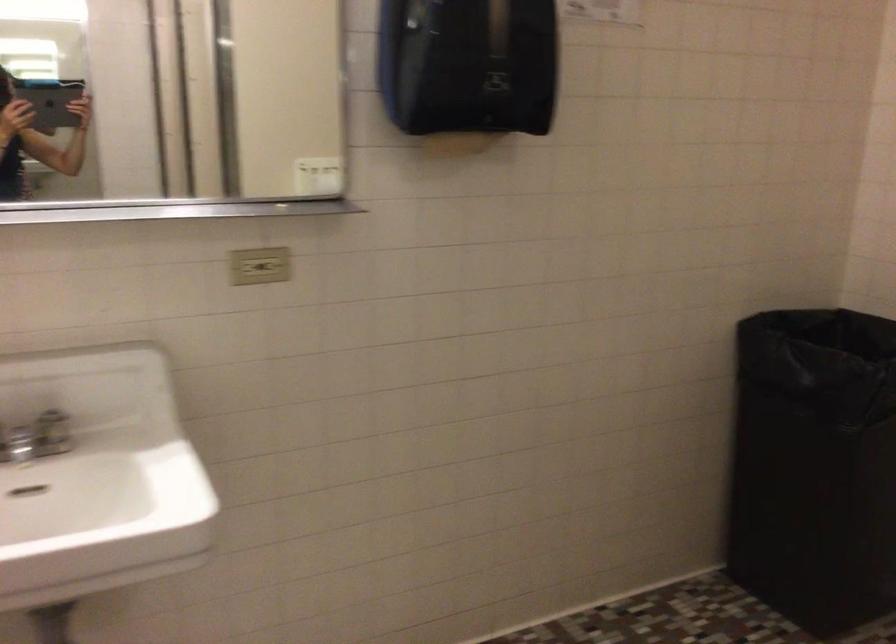
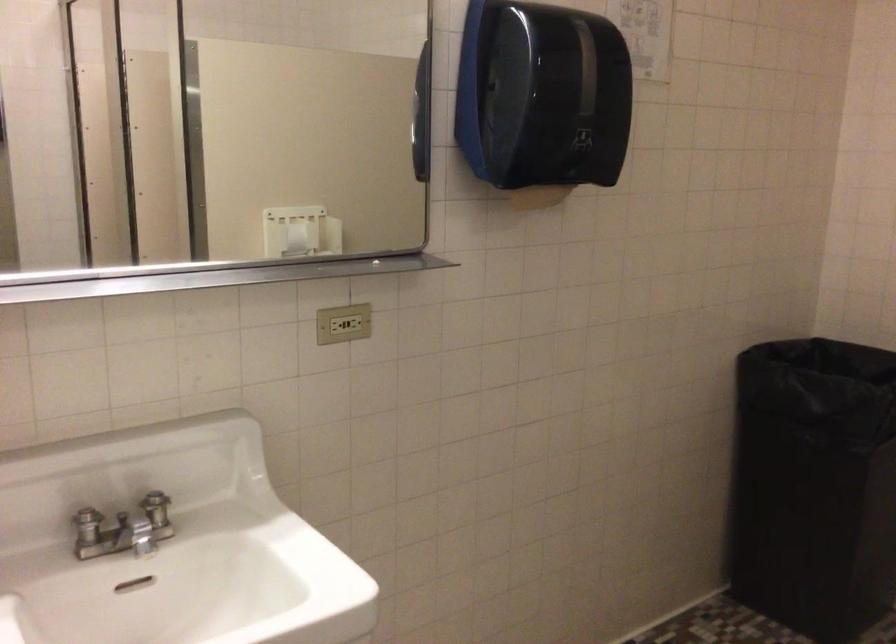
Question: The camera is either moving clockwise (left) or counter-clockwise (right) around the object. The first image is from the beginning of the video and the second image is from the end. Is the camera moving left or right when shooting the video?

Choices:
 (A) Left
 (B) Right

Answer: (A)